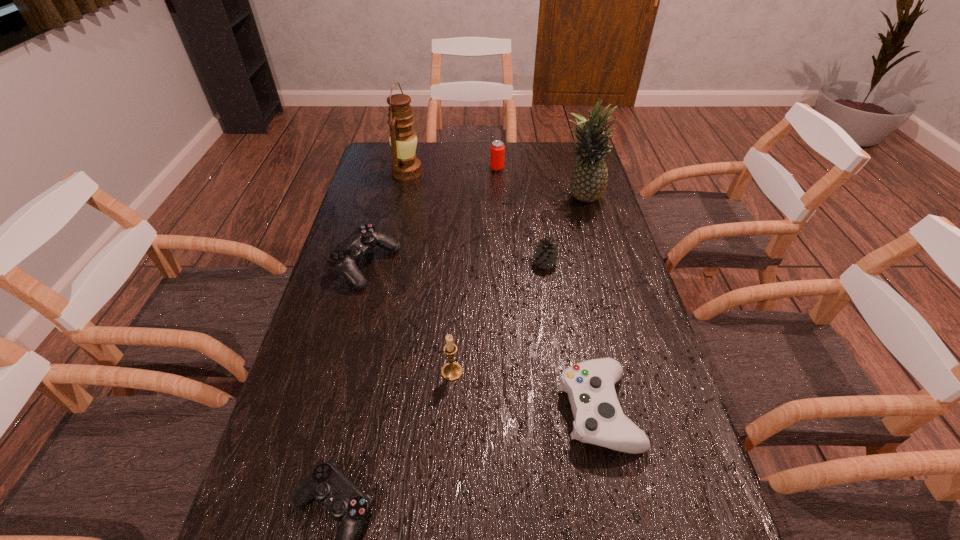
Where is `beer can located at the far edge`? beer can located at the far edge is located at coordinates (497, 148).

Where is `oil lamp positioned at the left edge`? oil lamp positioned at the left edge is located at coordinates (405, 166).

Identify the location of control present at the left edge. The height and width of the screenshot is (540, 960). (343, 258).

Identify the location of pineapple that is at the right edge. The width and height of the screenshot is (960, 540). (589, 178).

Find the location of a particular element. control positioned at the right edge is located at coordinates (598, 417).

You are a GUI agent. You are given a task and a screenshot of the screen. Output one action in this format:
    pyautogui.click(x=<x>, y=<y>)
    Task: Click on the object present at the far left corner
    
    Given the screenshot: What is the action you would take?
    pyautogui.click(x=405, y=166)

In the image, there is a desktop. Identify the location of vacant region at the far edge. The width and height of the screenshot is (960, 540). (452, 157).

Image resolution: width=960 pixels, height=540 pixels. In the image, there is a desktop. Identify the location of vacant space at the left edge. (365, 323).

What are the coordinates of `vacant space at the right edge of the desktop` in the screenshot? It's located at (623, 301).

The width and height of the screenshot is (960, 540). I want to click on vacant region at the far left corner of the desktop, so click(380, 148).